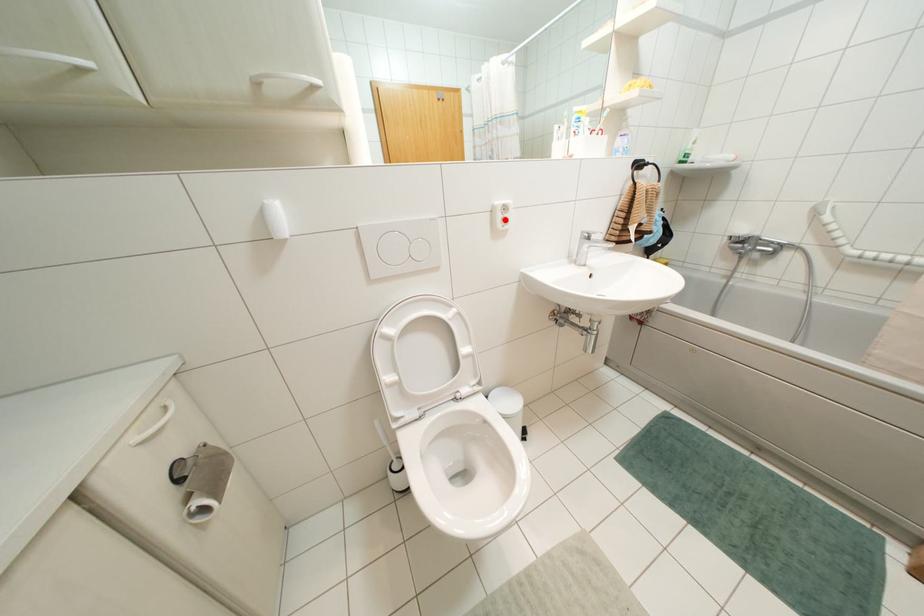
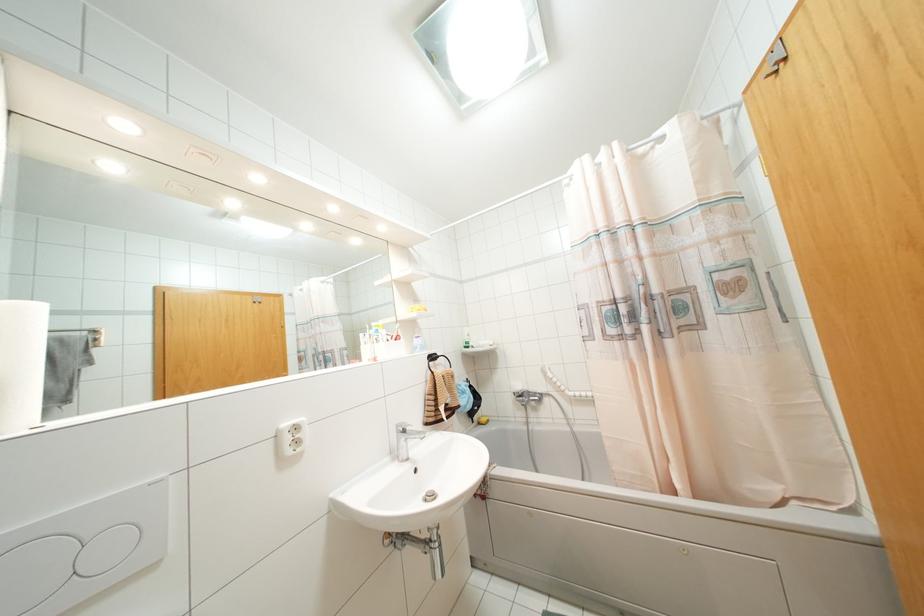
The point at the highlighted location is marked in the first image. Where is the corresponding point in the second image?

(297, 442)